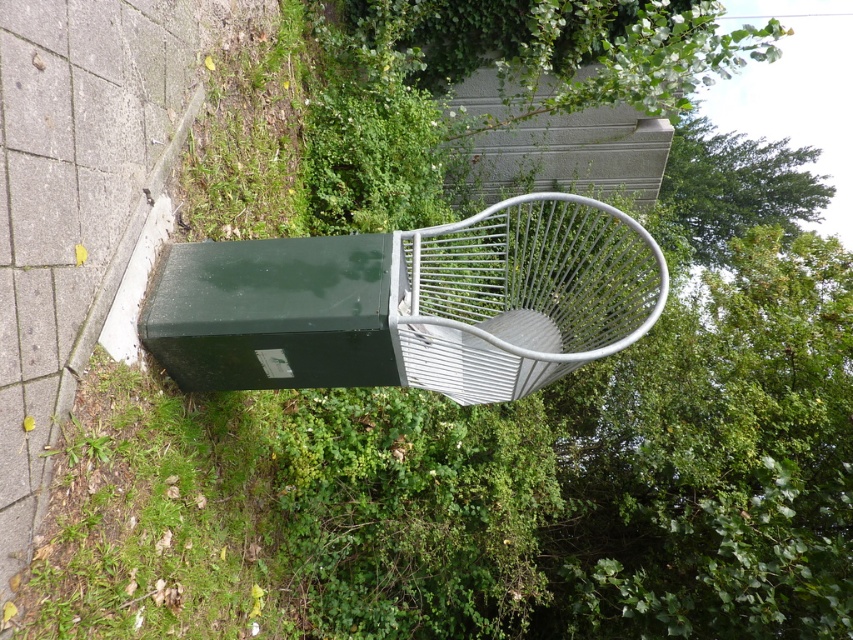
Where is `metallic wire chair at center`? The width and height of the screenshot is (853, 640). metallic wire chair at center is located at coordinates (412, 304).

Can you confirm if metallic wire chair at center is thinner than green leafy tree at upper center?

Yes.

Does point (366, 330) come behind point (374, 88)?

No, it is not.

The image size is (853, 640). I want to click on metallic wire chair at center, so click(x=412, y=304).

Between point (276, 573) and point (399, 17), which one is positioned in front?

Point (276, 573)

Is green grass at lower left thinner than green leafy tree at upper center?

Correct, green grass at lower left's width is less than green leafy tree at upper center's.

Between point (155, 412) and point (556, 93), which one is positioned behind?

The point (556, 93) is behind.

You are a GUI agent. You are given a task and a screenshot of the screen. Output one action in this format:
    pyautogui.click(x=<x>, y=<y>)
    Task: Click on the green grass at lower left
    Image resolution: width=853 pixels, height=640 pixels.
    Given the screenshot: What is the action you would take?
    [x=158, y=516]

Does point (567, 106) lie in front of point (752, 216)?

That is True.

Between green leafy tree at upper center and green leafy tree at upper right, which one is positioned higher?

Positioned higher is green leafy tree at upper center.

Is point (422, 26) farther from viewer compared to point (718, 209)?

No, (422, 26) is in front of (718, 209).

At what (x,y) coordinates should I click in order to perform the action: click on green leafy tree at upper center. Please return your answer as a coordinate pair (x, y). The image size is (853, 640). Looking at the image, I should click on (546, 49).